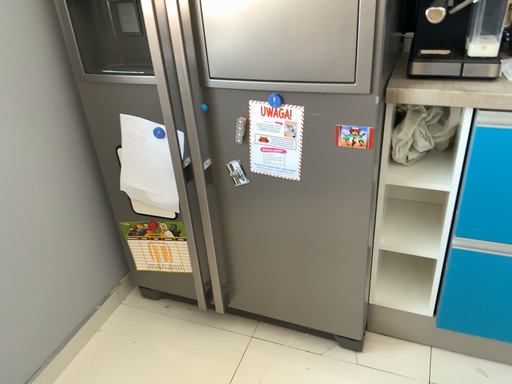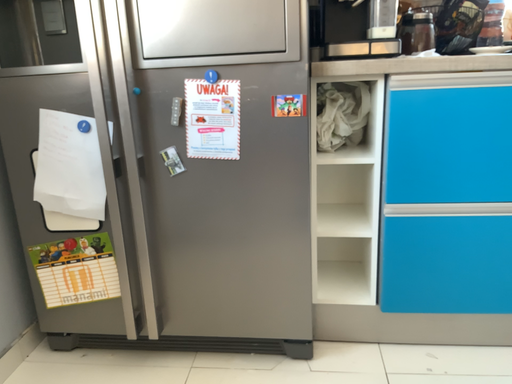
Question: Which way did the camera rotate in the video?

Choices:
 (A) rotated left
 (B) rotated right

Answer: (B)